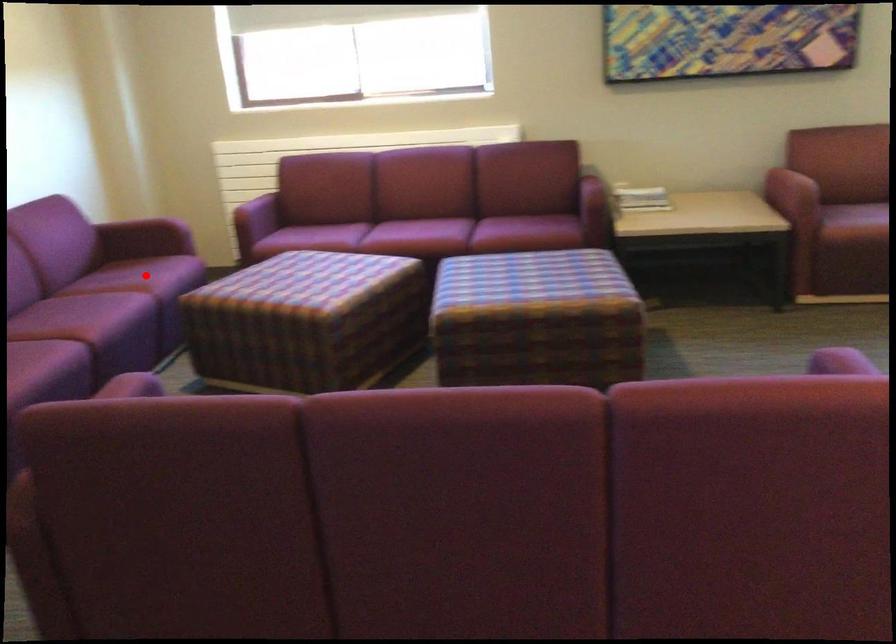
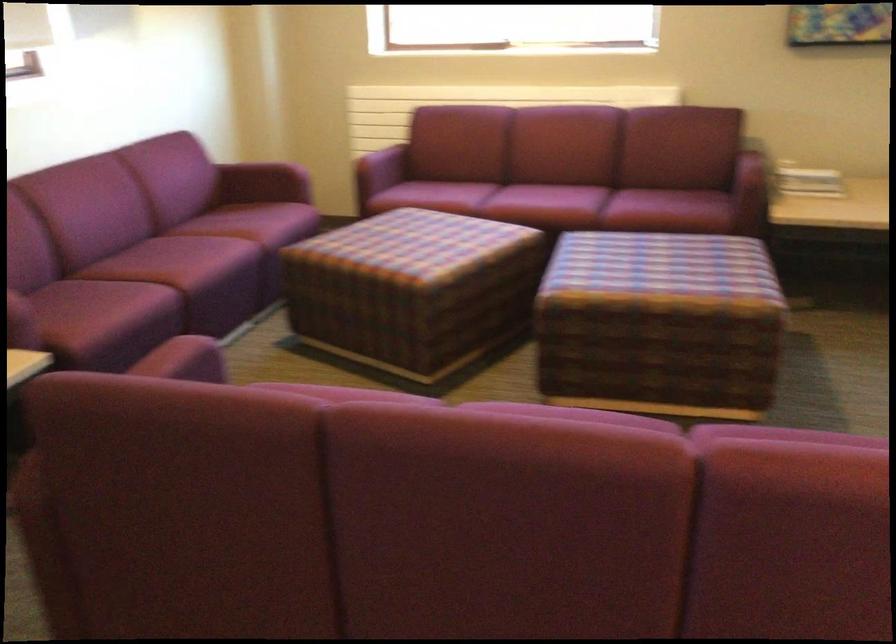
The point at the highlighted location is marked in the first image. Where is the corresponding point in the second image?

(254, 222)